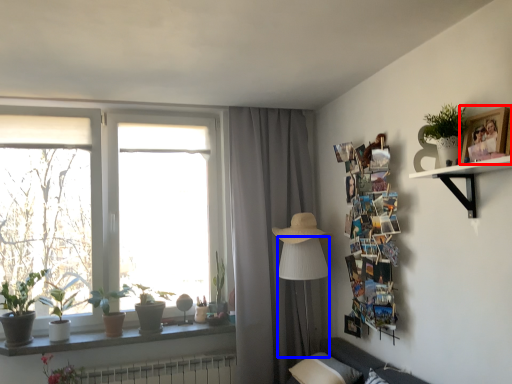
Question: Among these objects, which one is farthest to the camera, picture frame (highlighted by a red box) or table lamp (highlighted by a blue box)?

Choices:
 (A) picture frame
 (B) table lamp

Answer: (B)